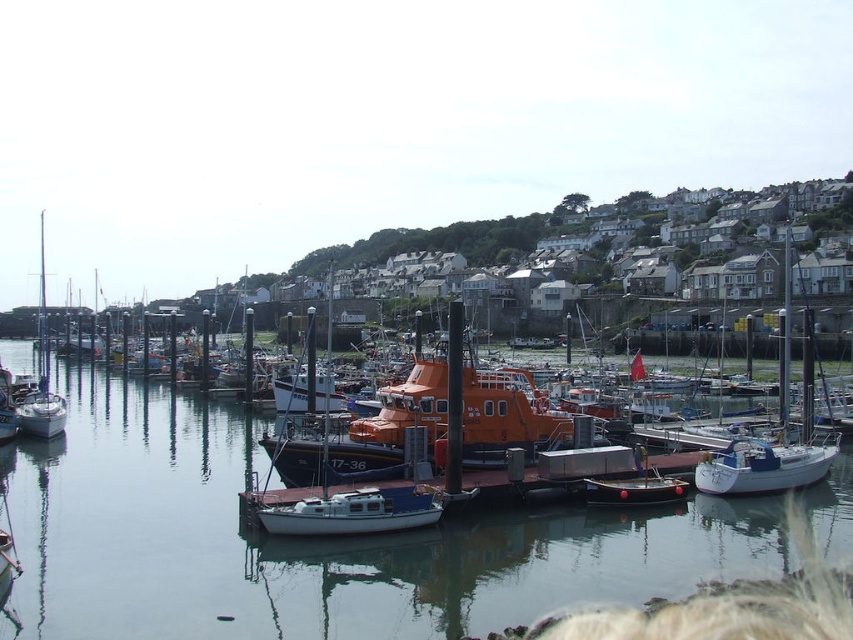
Is smooth water at center bigger than wooden polished boat at center?

Yes, smooth water at center is bigger than wooden polished boat at center.

Is smooth water at center smaller than wooden polished boat at center?

Actually, smooth water at center might be larger than wooden polished boat at center.

Which is behind, point (71, 428) or point (607, 499)?

Positioned behind is point (71, 428).

Where is `smooth water at center`? Image resolution: width=853 pixels, height=640 pixels. smooth water at center is located at coordinates (309, 541).

Is smooth water at center wider than white glossy sailboat at right?

Correct, the width of smooth water at center exceeds that of white glossy sailboat at right.

Does point (390, 628) lie behind point (804, 385)?

No, (390, 628) is closer to viewer.

Find the location of a particular element. This screenshot has width=853, height=640. smooth water at center is located at coordinates (309, 541).

Who is shorter, white matte sailboat at left or wooden polished boat at center?

wooden polished boat at center

Which is behind, point (22, 420) or point (646, 500)?

The point (22, 420) is behind.

Measure the distance between point (41, 403) and camera.

71.50 meters

Locate an element on the screen. This screenshot has width=853, height=640. white matte sailboat at left is located at coordinates (39, 374).